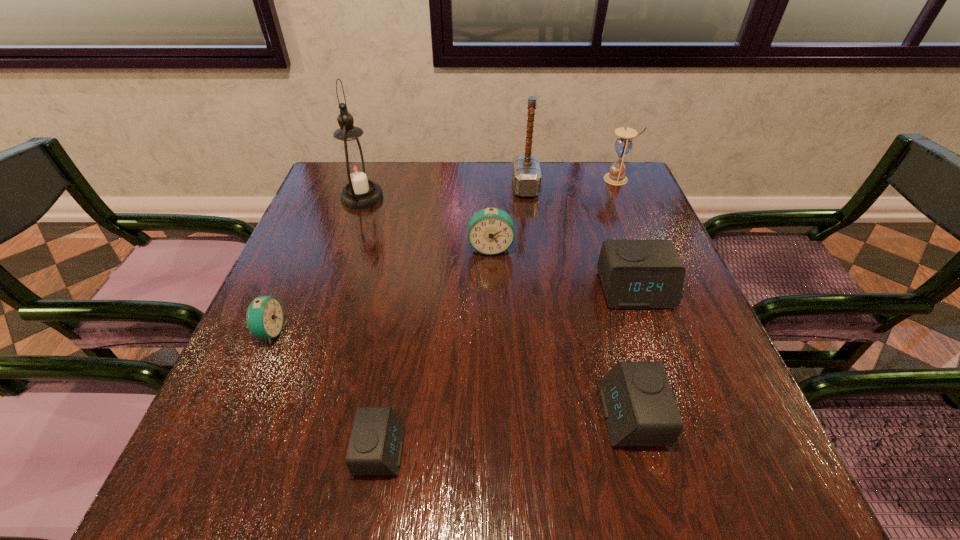
In the image, there is a desktop. Identify the location of free space at the far right corner. (625, 187).

I want to click on vacant region between the smaller blue alarm clock and the second farthest alarm clock, so click(452, 311).

Where is `vacant area that lies between the shortest alarm clock and the fifth farthest object`? vacant area that lies between the shortest alarm clock and the fifth farthest object is located at coordinates (x=508, y=369).

You are a GUI agent. You are given a task and a screenshot of the screen. Output one action in this format:
    pyautogui.click(x=<x>, y=<y>)
    Task: Click on the vacant area between the fourth object from right to left and the biggest black alarm clock
    The image size is (960, 540).
    Given the screenshot: What is the action you would take?
    pyautogui.click(x=580, y=239)

The image size is (960, 540). In order to click on free point between the fourth nearest object and the hammer in this screenshot , I will do `click(580, 239)`.

Locate an element on the screen. The image size is (960, 540). free space between the fifth nearest object and the third nearest alarm clock is located at coordinates (380, 290).

This screenshot has width=960, height=540. I want to click on vacant area between the third nearest object and the second smallest black alarm clock, so click(x=450, y=374).

I want to click on unoccupied area between the shortest object and the seventh shortest object, so click(x=453, y=318).

Image resolution: width=960 pixels, height=540 pixels. I want to click on vacant point located between the third farthest alarm clock and the tallest object, so click(316, 265).

Identify the location of vacant space in between the brown hammer and the seventh object from right to left. This screenshot has height=540, width=960. (444, 192).